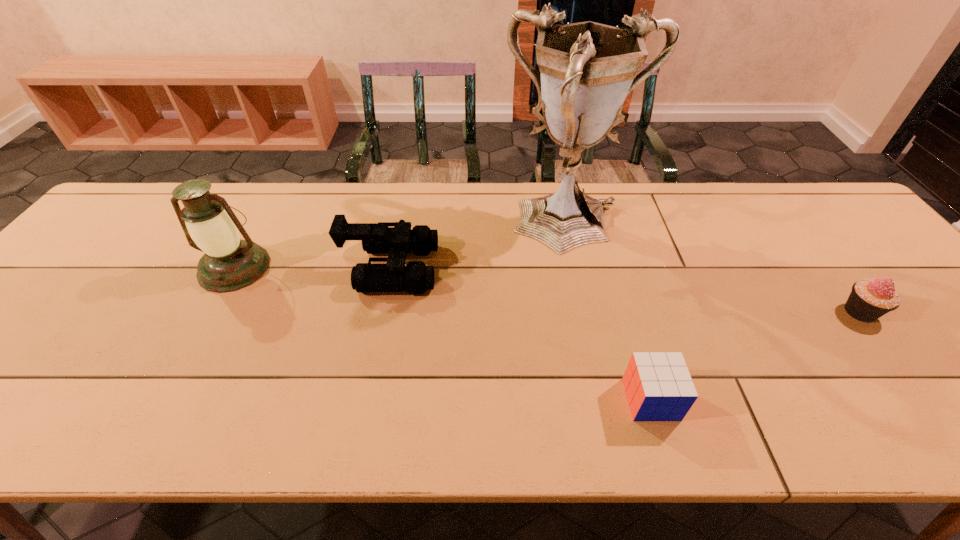
Identify the location of vacant region at the right edge of the desktop. (916, 302).

At what (x,y) coordinates should I click in order to perform the action: click on vacant space at the far left corner of the desktop. Please return your answer as a coordinate pair (x, y). Looking at the image, I should click on (165, 203).

Identify the location of vacant space that's between the lantern and the second shortest object. (547, 290).

The image size is (960, 540). In order to click on free space that is in between the third tallest object and the tallest object in this screenshot , I will do `click(481, 247)`.

The width and height of the screenshot is (960, 540). I want to click on vacant space that is in between the shortest object and the third shortest object, so click(520, 334).

This screenshot has width=960, height=540. What are the coordinates of `vacant region between the leftmost object and the third tallest object` in the screenshot? It's located at (313, 268).

Locate an element on the screen. The width and height of the screenshot is (960, 540). blank region between the fourth object from right to left and the second tallest object is located at coordinates click(x=313, y=268).

The image size is (960, 540). I want to click on vacant space that's between the fourth tallest object and the fourth object from right to left, so click(x=625, y=290).

Where is `vacant space that's between the nearest object and the lantern`? vacant space that's between the nearest object and the lantern is located at coordinates (443, 333).

The image size is (960, 540). Find the location of `vacant point located between the rightmost object and the trophy cup`. vacant point located between the rightmost object and the trophy cup is located at coordinates (715, 269).